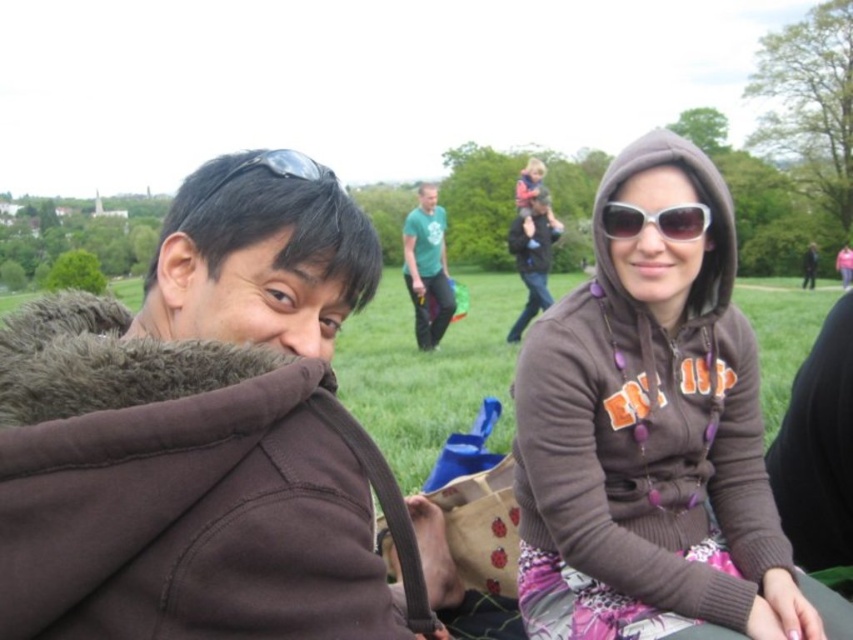
You are a photographer trying to capture a group photo of the people in the scene. You notice the brown hoodie at center and the matte pink hoodie at upper center. Which hoodie should you focus on first to ensure both are in frame?

The brown hoodie at center is smaller than the matte pink hoodie at upper center, so you should focus on the matte pink hoodie at upper center first to ensure both are in frame.

From the picture: You are standing at the center of the park and want to find the green fabric shirt at center. According to the coordinates provided, in which direction should you move to locate it?

The green fabric shirt at center is located at coordinates point (427, 268), so you should move towards the center of the park to find it.